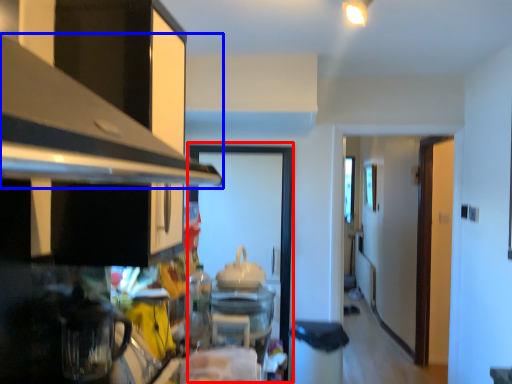
Question: Which object appears farthest to the camera in this image, glass door (highlighted by a red box) or exhaust hood (highlighted by a blue box)?

Choices:
 (A) glass door
 (B) exhaust hood

Answer: (A)